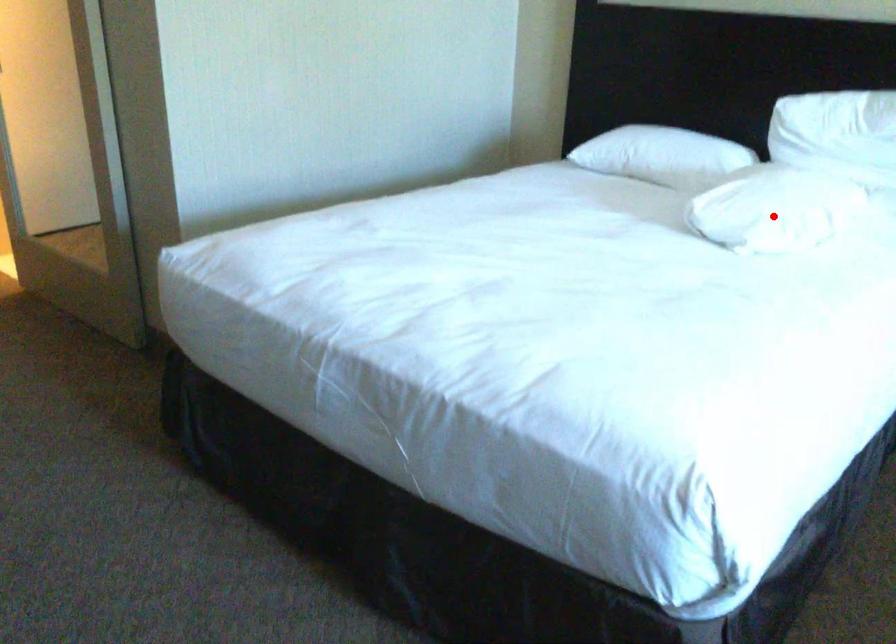
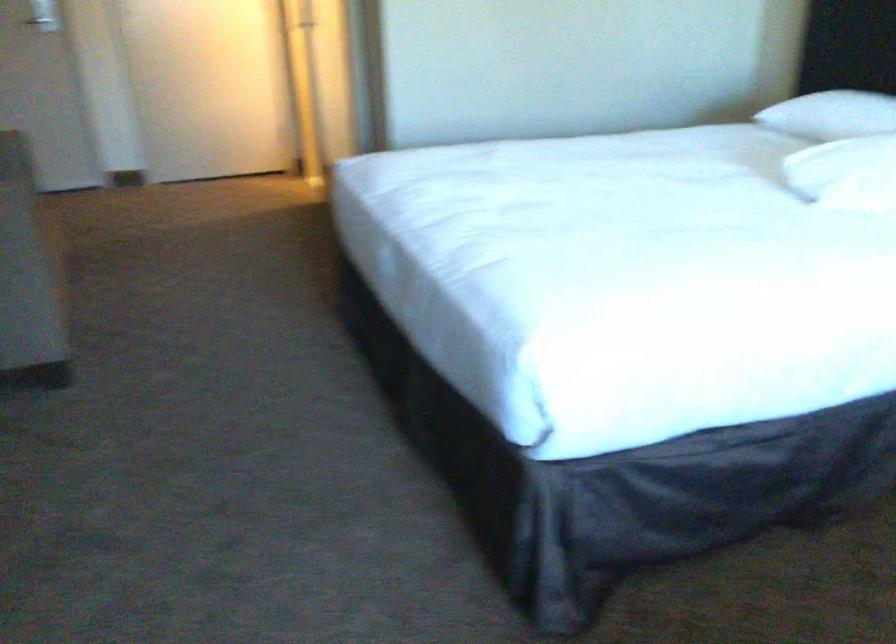
The point at the highlighted location is marked in the first image. Where is the corresponding point in the second image?

(846, 173)